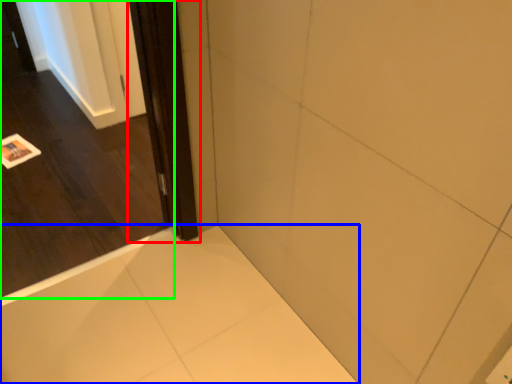
Question: Based on their relative distances, which object is nearer to screen door (highlighted by a red box)? Choose from bath (highlighted by a blue box) and door (highlighted by a green box).

Choices:
 (A) bath
 (B) door

Answer: (A)